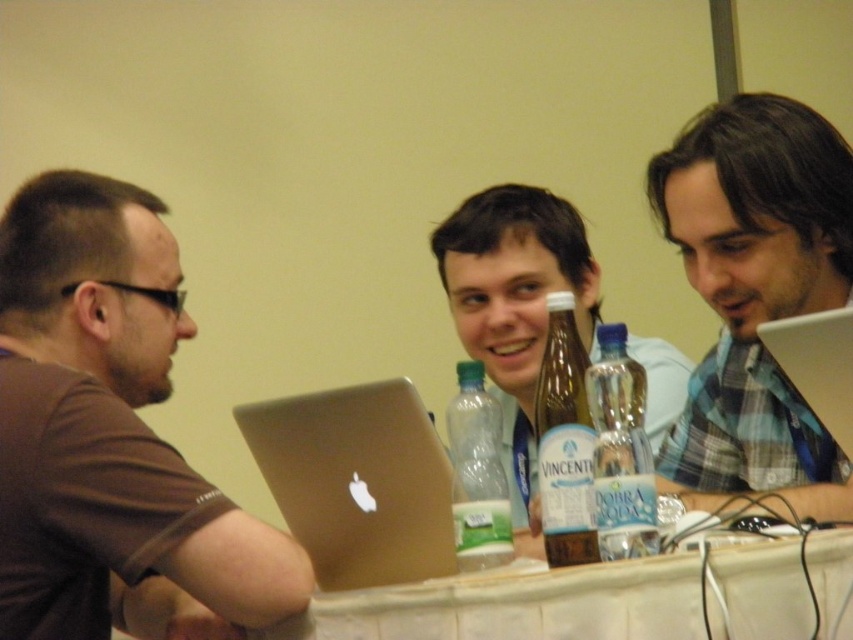
Question: Which point is farther from the camera taking this photo?

Choices:
 (A) (608, 512)
 (B) (497, 428)
 (C) (714, 188)

Answer: (C)

Question: Is white fabric table at center bigger than silver metallic laptop at right?

Choices:
 (A) yes
 (B) no

Answer: (A)

Question: Does plaid shirt at center have a smaller size compared to clear plastic bottle at right?

Choices:
 (A) no
 (B) yes

Answer: (A)

Question: Which point is farther to the camera?

Choices:
 (A) translucent plastic bottle at center
 (B) translucent glass bottle at center
 (C) satin gold laptop at center
 (D) brown matte shirt at left

Answer: (A)

Question: Which of these objects is positioned closest to the plaid shirt at center?

Choices:
 (A) matte plastic bottle at center
 (B) brown matte shirt at left
 (C) clear plastic bottle at right

Answer: (C)

Question: Does clear plastic bottle at right lie behind silver metallic laptop at right?

Choices:
 (A) no
 (B) yes

Answer: (A)